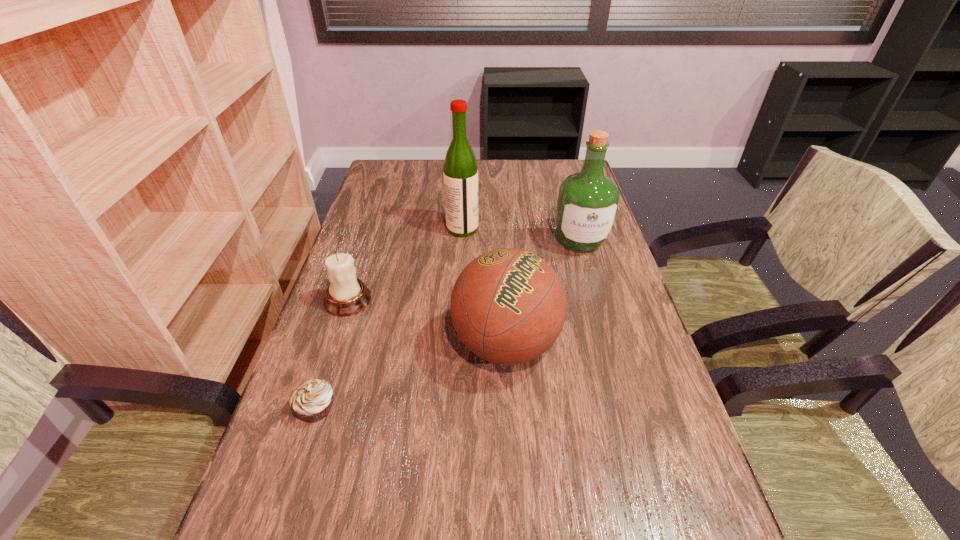
Find the location of a particular element. The width and height of the screenshot is (960, 540). the left liquor is located at coordinates 460,169.

Find the location of a particular element. This screenshot has width=960, height=540. the right liquor is located at coordinates (588, 201).

This screenshot has height=540, width=960. What are the coordinates of `the third shortest object` in the screenshot? It's located at (508, 306).

Where is `the fourth tallest object`? This screenshot has height=540, width=960. the fourth tallest object is located at coordinates click(x=346, y=295).

Where is `the nearest object`? This screenshot has width=960, height=540. the nearest object is located at coordinates (311, 402).

Image resolution: width=960 pixels, height=540 pixels. I want to click on muffin, so click(311, 402).

This screenshot has height=540, width=960. I want to click on free space located 0.070m on the label of the left liquor, so click(501, 229).

Find the location of a particular element. vacant space located on the front-facing side of the rightmost object is located at coordinates (611, 349).

At what (x,y) coordinates should I click in order to perform the action: click on free location located on the back of the third tallest object. Please return your answer as a coordinate pair (x, y). Looking at the image, I should click on (501, 268).

The height and width of the screenshot is (540, 960). Find the location of `vacant space located on the right of the second shortest object`. vacant space located on the right of the second shortest object is located at coordinates (522, 300).